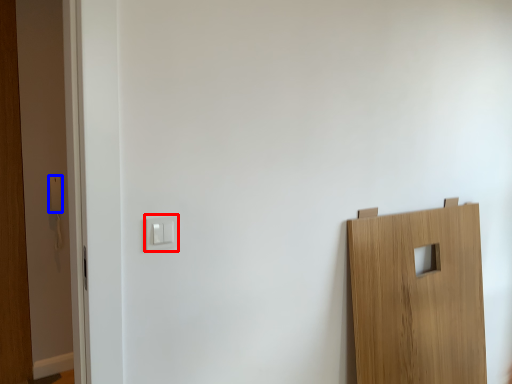
Question: Which object appears closest to the camera in this image, light switch (highlighted by a red box) or light switch (highlighted by a blue box)?

Choices:
 (A) light switch
 (B) light switch

Answer: (A)